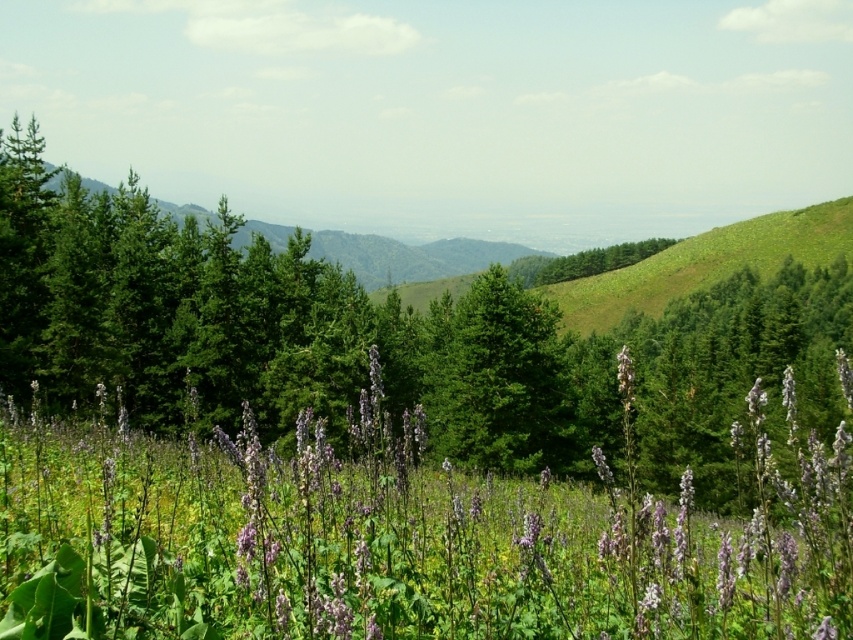
Does point (558, 340) come closer to viewer compared to point (671, 241)?

Yes, point (558, 340) is closer to viewer.

Does green glossy tree at center have a lesser height compared to green leafy tree at center?

Yes.

This screenshot has height=640, width=853. Identify the location of green glossy tree at center. (498, 378).

Is purple matte flower at center to the left of green glossy tree at center from the viewer's perspective?

Correct, you'll find purple matte flower at center to the left of green glossy tree at center.

Is point (787, 621) closer to viewer compared to point (492, 438)?

Yes, it is in front of point (492, 438).

This screenshot has height=640, width=853. I want to click on purple matte flower at center, so click(x=402, y=540).

Between green matte tree at center and green leafy tree at center, which one appears on the left side from the viewer's perspective?

green matte tree at center

Does green matte tree at center have a lesser width compared to green leafy tree at center?

No.

Image resolution: width=853 pixels, height=640 pixels. What are the coordinates of `green matte tree at center` in the screenshot? It's located at (376, 339).

You are a GUI agent. You are given a task and a screenshot of the screen. Output one action in this format:
    pyautogui.click(x=<x>, y=<y>)
    Task: Click on the green matte tree at center
    The height and width of the screenshot is (640, 853).
    Given the screenshot: What is the action you would take?
    pyautogui.click(x=376, y=339)